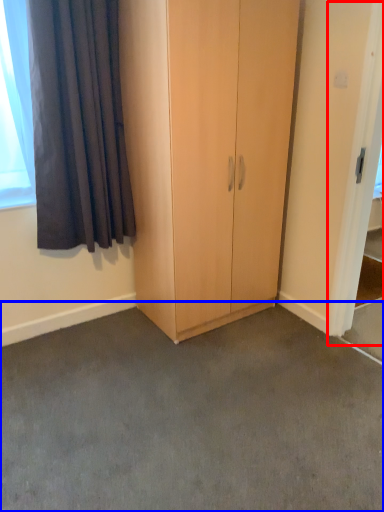
Question: Which object is closer to the camera taking this photo, screen door (highlighted by a red box) or concrete (highlighted by a blue box)?

Choices:
 (A) screen door
 (B) concrete

Answer: (B)